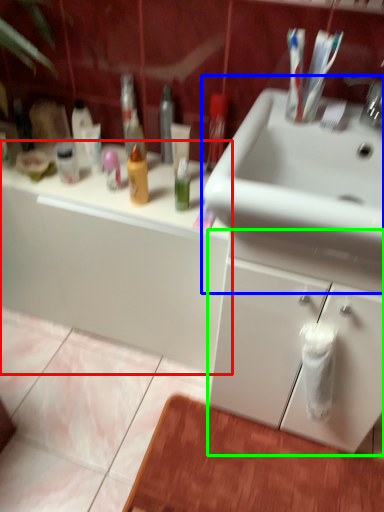
Question: Which object is positioned closest to bathroom cabinet (highlighted by a red box)? Select from sink (highlighted by a blue box) and bathroom cabinet (highlighted by a green box).

Choices:
 (A) sink
 (B) bathroom cabinet

Answer: (B)